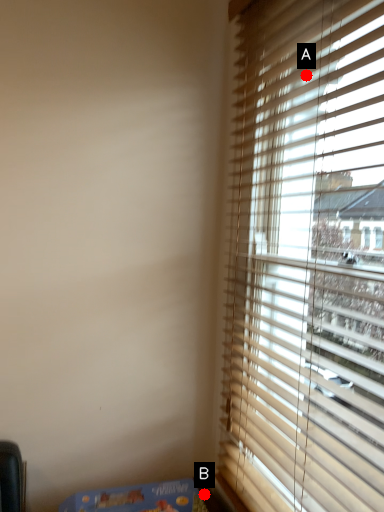
Question: Two points are circled on the image, labeled by A and B beside each circle. Which point is farther to the camera?

Choices:
 (A) A is further
 (B) B is further

Answer: (B)